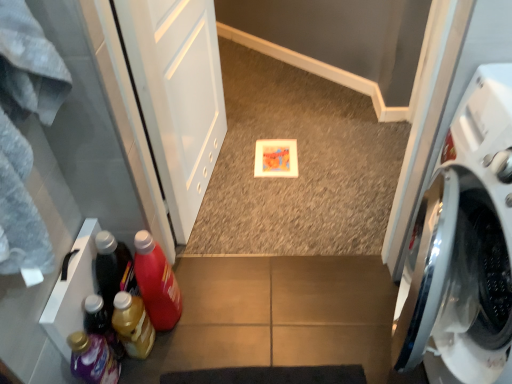
Image resolution: width=512 pixels, height=384 pixels. I want to click on vacant region under white glossy screen door at upper left (from a real-world perspective), so click(209, 187).